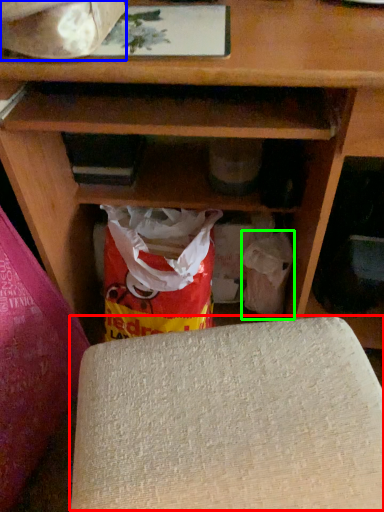
Question: Estimate the real-world distances between objects in this image. Which object is farther from yoga mat (highlighted by a red box), wrapping paper (highlighted by a blue box) or grocery bag (highlighted by a green box)?

Choices:
 (A) wrapping paper
 (B) grocery bag

Answer: (A)